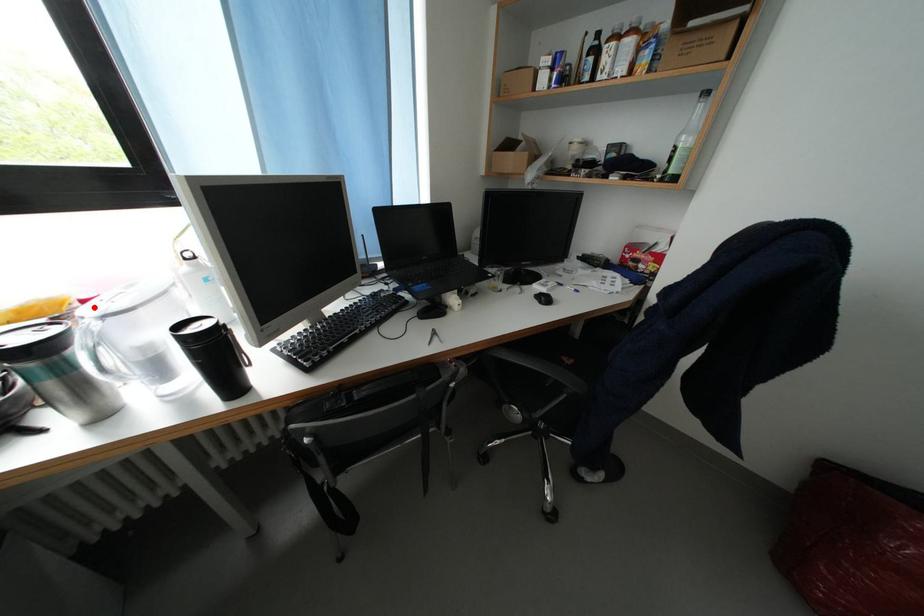
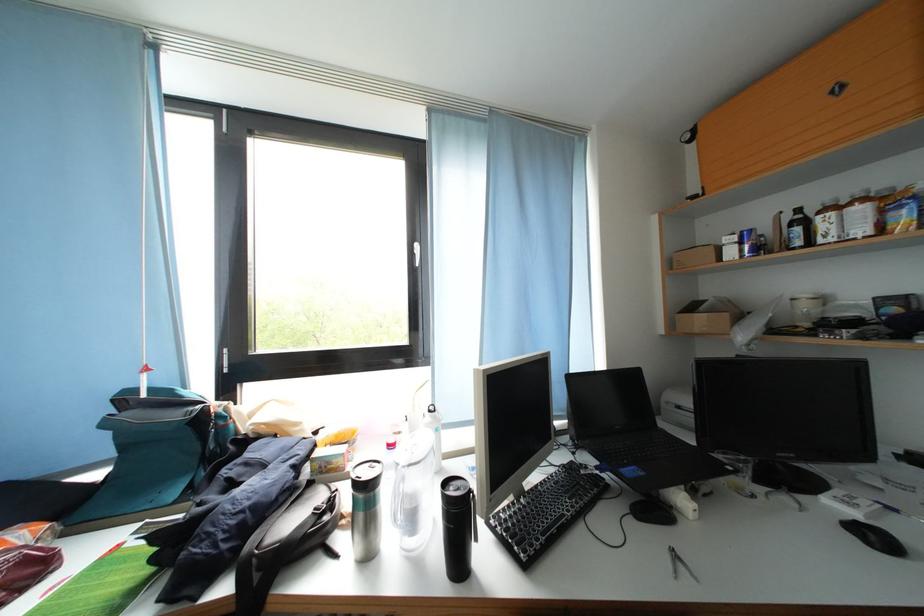
Find the pixel in the second image that matches the highlighted location in the first image.

(398, 451)